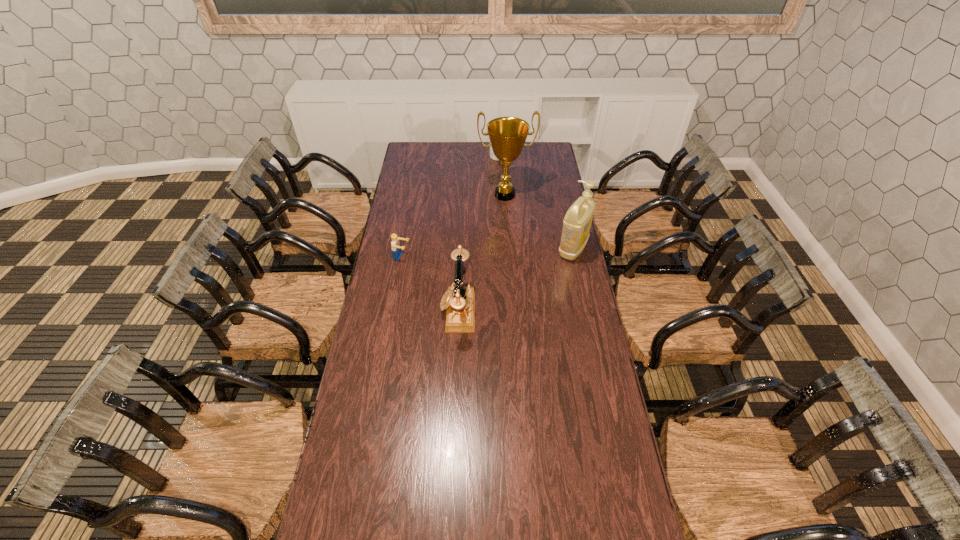
Where is `free space located 0.160m on the front view with handles of the award`? This screenshot has height=540, width=960. free space located 0.160m on the front view with handles of the award is located at coordinates (509, 226).

What are the coordinates of `object at the far edge` in the screenshot? It's located at (492, 156).

The image size is (960, 540). I want to click on object located in the left edge section of the desktop, so click(x=395, y=244).

This screenshot has height=540, width=960. What are the coordinates of `object that is at the right edge` in the screenshot? It's located at (577, 222).

Where is `blank space at the far edge`? This screenshot has width=960, height=540. blank space at the far edge is located at coordinates (527, 148).

This screenshot has height=540, width=960. In the image, there is a desktop. Find the location of `free space at the near edge`. free space at the near edge is located at coordinates (535, 522).

You are a GUI agent. You are given a task and a screenshot of the screen. Output one action in this format:
    pyautogui.click(x=<x>, y=<y>)
    Task: Click on the vacant region at the left edge of the desktop
    
    Given the screenshot: What is the action you would take?
    pyautogui.click(x=407, y=315)

In the image, there is a desktop. Where is `free region at the right edge`? This screenshot has width=960, height=540. free region at the right edge is located at coordinates pos(586,382).

At what (x,y) coordinates should I click in order to perform the action: click on free point at the far left corner. Please return your answer as a coordinate pair (x, y). Looking at the image, I should click on (413, 154).

The width and height of the screenshot is (960, 540). I want to click on vacant area that lies between the cup and the Lego, so click(x=450, y=208).